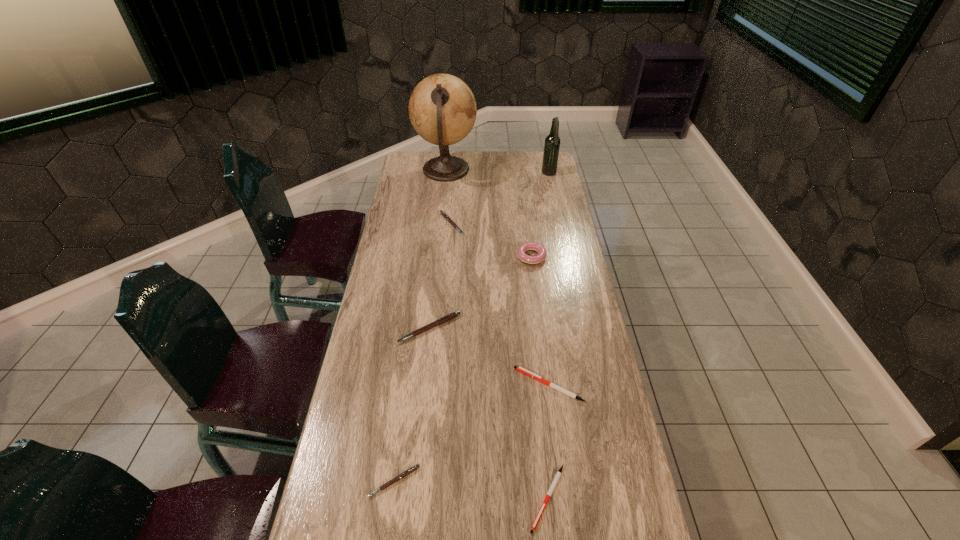
Identify the location of the third nearest pen. Image resolution: width=960 pixels, height=540 pixels. (520, 369).

Identify the location of the nearest pink pen. This screenshot has height=540, width=960. (412, 469).

The width and height of the screenshot is (960, 540). What are the coordinates of `the nearer white pen` in the screenshot? It's located at (558, 474).

Where is `free space located 0.070m on the front-facing side of the tallest object`? free space located 0.070m on the front-facing side of the tallest object is located at coordinates (492, 170).

The height and width of the screenshot is (540, 960). What are the coordinates of `vacant region located 0.240m on the front of the dark beer bottle` in the screenshot? It's located at (557, 210).

Where is `vacant point located 0.320m on the back of the fourth farthest object`? The image size is (960, 540). vacant point located 0.320m on the back of the fourth farthest object is located at coordinates (524, 200).

Identify the location of vacant region located at the nib of the fourth nearest pen. (423, 387).

Locate an element on the screen. This screenshot has width=960, height=540. vacant region located at the nib of the second biggest pink pen is located at coordinates (533, 224).

Where is `free location located 0.080m on the clicker of the third nearest pen`? The height and width of the screenshot is (540, 960). free location located 0.080m on the clicker of the third nearest pen is located at coordinates (487, 385).

Locate an element on the screen. vacant area situated on the clicker of the third nearest pen is located at coordinates (487, 385).